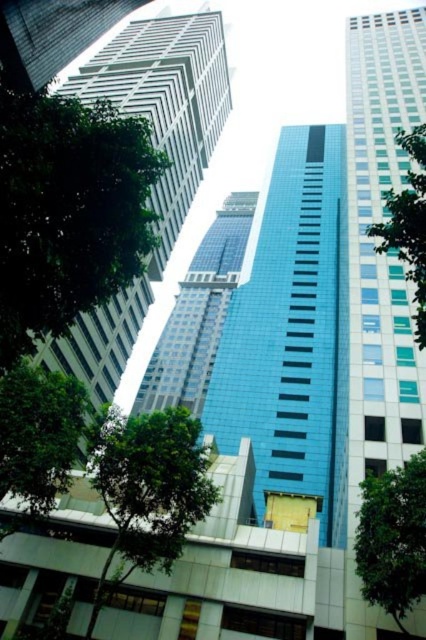
Question: Among these points, which one is farthest from the camera?

Choices:
 (A) (126, 524)
 (B) (370, 481)
 (C) (114, 280)

Answer: (B)

Question: Does blue glassy tower at center lie in front of green leafy tree at right?

Choices:
 (A) yes
 (B) no

Answer: (B)

Question: Estimate the real-world distances between objects in this image. Which object is farther from the green leafy tree at lower left?

Choices:
 (A) green leafy tree at lower right
 (B) green leafy tree at center

Answer: (A)

Question: Does green leafy tree at left appear on the right side of green leafy tree at lower left?

Choices:
 (A) yes
 (B) no

Answer: (A)

Question: Can you confirm if blue glassy tower at center is positioned to the right of green leafy tree at lower left?

Choices:
 (A) yes
 (B) no

Answer: (B)

Question: Which object is farther from the camera taking this photo?

Choices:
 (A) green leafy tree at lower right
 (B) blue glassy tower at center

Answer: (B)